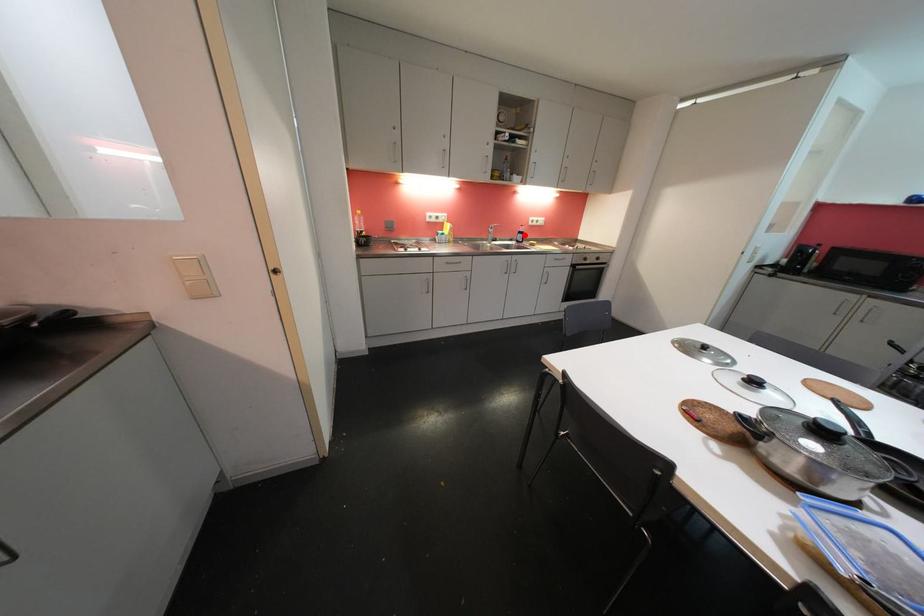
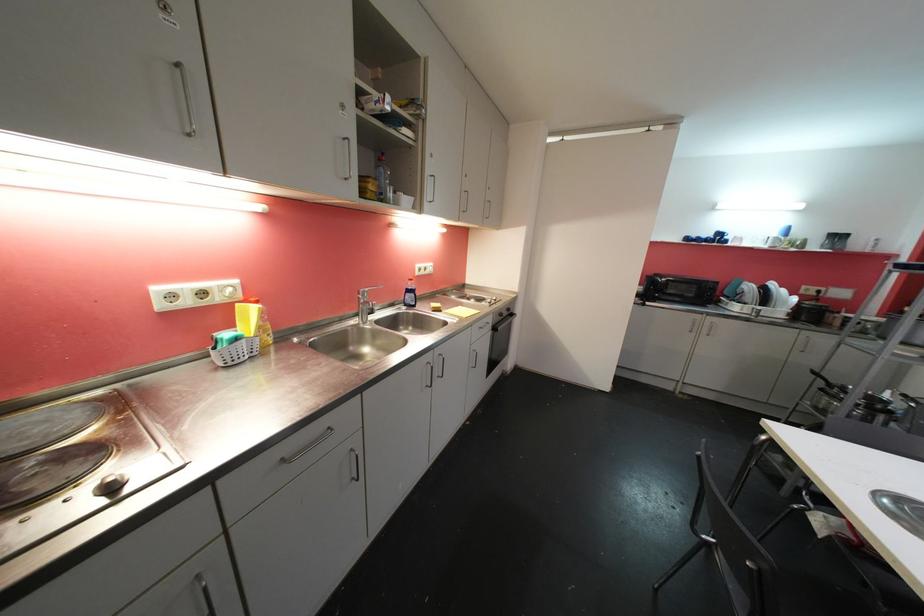
The point at the highlighted location is marked in the first image. Where is the corresponding point in the second image?

(414, 293)